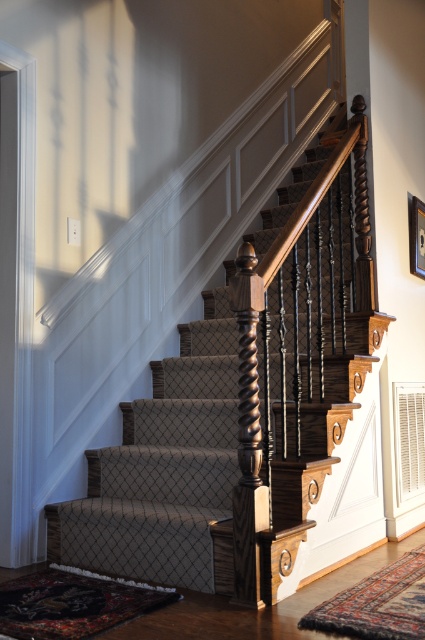
You are moving a large painting and need to determine if it can fit through the space between the carpeted stairs at center and the wooden picture frame at upper right. What should you consider about their sizes?

The carpeted stairs at center is bigger than the wooden picture frame at upper right, so the space between them may be limited. You should measure the size of the painting against the smaller of the two objects to ensure it can pass through.

You are a painter who needs to hang a new painting. You have the wooden picture frame at upper right and the carpeted stairs at center in view. Which object is higher up in the image?

The carpeted stairs at center is much taller as wooden picture frame at upper right, so the carpeted stairs at center is higher up in the image.